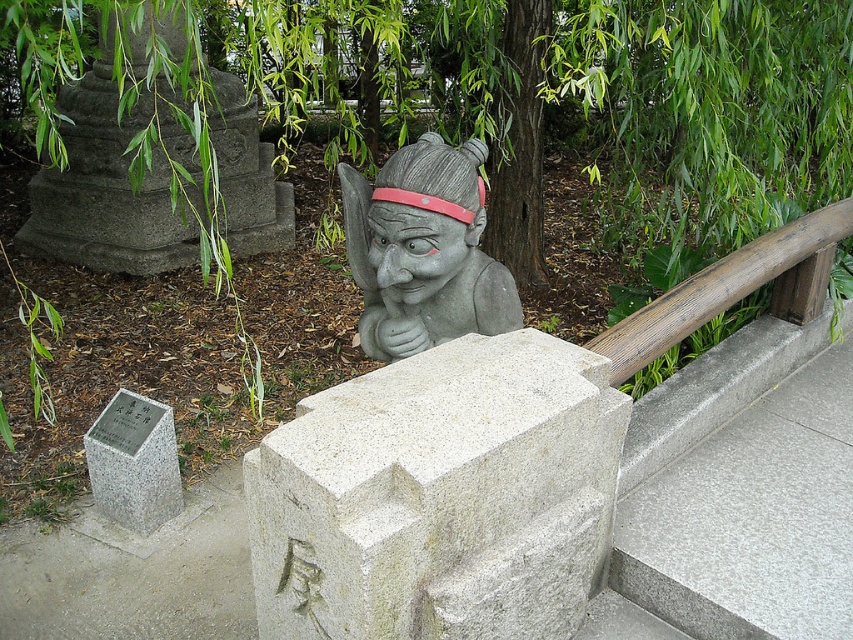
Is point (759, 124) farther from camera compared to point (138, 420)?

Yes, point (759, 124) is behind point (138, 420).

Does point (675, 29) come in front of point (90, 444)?

Yes, point (675, 29) is in front of point (90, 444).

Image resolution: width=853 pixels, height=640 pixels. Find the location of `green leafy tree at upper center`. green leafy tree at upper center is located at coordinates (577, 100).

What do you see at coordinates (577, 100) in the screenshot?
I see `green leafy tree at upper center` at bounding box center [577, 100].

Is green leafy tree at upper center further to the viewer compared to gray stone statue at center?

Yes, it is.

What do you see at coordinates (577, 100) in the screenshot? I see `green leafy tree at upper center` at bounding box center [577, 100].

Find the location of a particular element. green leafy tree at upper center is located at coordinates click(x=577, y=100).

Is white stone at center bigger than gray polished concrete at upper right?

Incorrect, white stone at center is not larger than gray polished concrete at upper right.

Who is more distant from viewer, (437, 412) or (761, 490)?

Point (761, 490)

Where is `white stone at center`? white stone at center is located at coordinates (440, 497).

The image size is (853, 640). I want to click on white stone at center, so click(x=440, y=497).